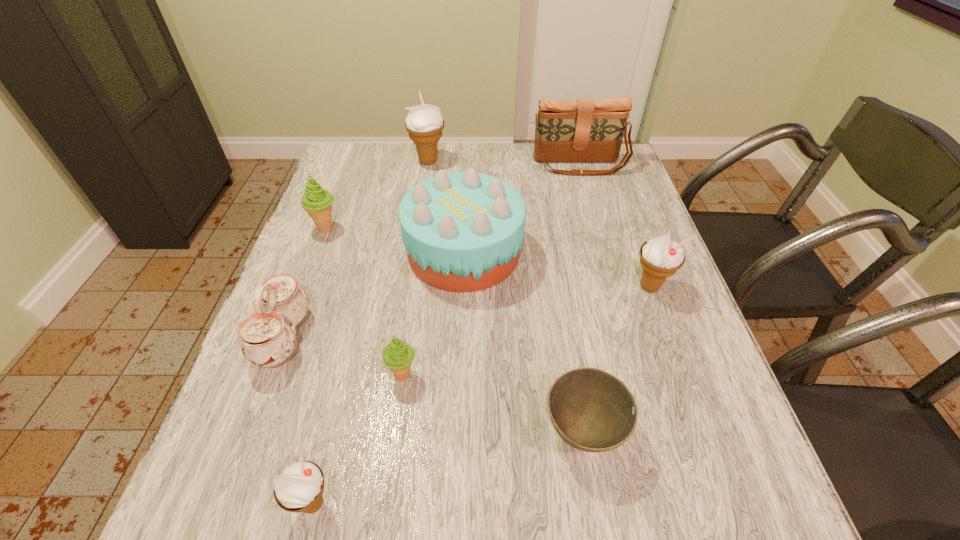
This screenshot has width=960, height=540. In order to click on free space located 0.340m by the handle of the chinaware in this screenshot , I will do `click(470, 337)`.

In order to click on vacant region located 0.170m on the right of the second nearest icecream in this screenshot , I will do `click(506, 375)`.

At what (x,y) coordinates should I click in order to perform the action: click on free location located 0.340m on the right of the second icecream from left to right. Please return your answer as a coordinate pair (x, y). Image resolution: width=960 pixels, height=540 pixels. Looking at the image, I should click on (551, 503).

Locate an element on the screen. Image resolution: width=960 pixels, height=540 pixels. vacant space located on the right of the bowl is located at coordinates (737, 431).

The image size is (960, 540). What are the coordinates of `icecream that is at the far edge` in the screenshot? It's located at (424, 123).

This screenshot has height=540, width=960. What are the coordinates of `shoulder bag that is at the far edge` in the screenshot? It's located at (583, 130).

The width and height of the screenshot is (960, 540). In order to click on object located in the near edge section of the desktop in this screenshot , I will do `click(301, 483)`.

Locate an element on the screen. chinaware at the left edge is located at coordinates (268, 337).

Find the location of a particular element. Image resolution: width=960 pixels, height=540 pixels. shoulder bag that is at the right edge is located at coordinates (583, 130).

Identify the location of icecream situated at the right edge. (660, 257).